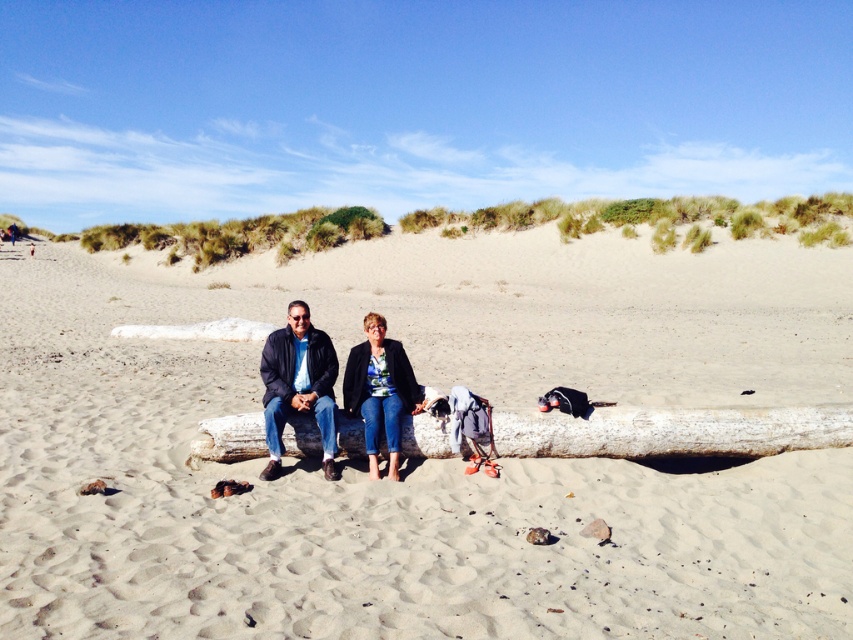
You are standing on the beach and want to place a small picnic blanket. The smooth sand at center is the best spot for it. Where exactly should you place the blanket according to the coordinates provided?

The smooth sand at center is located at point (428, 460), so you should place the picnic blanket there.

You are standing at the point marked as point (428, 460) on the beach. Looking around, you see the large weathered log and the two people sitting on it. Which direction should you walk to reach the smooth sand at center?

The point (428, 460) is already located on the smooth sand at center, so you are already standing on it.

You are standing on the beach and want to place a small seashell on the smooth sand at center. However, there is a dark blue leather jacket at center in the way. Can you place the seashell directly on the sand without moving the jacket?

The smooth sand at center is closer to the viewer than the dark blue leather jacket at center, so you can place the seashell directly on the sand without moving the jacket because the jacket is further away and not blocking the sand.